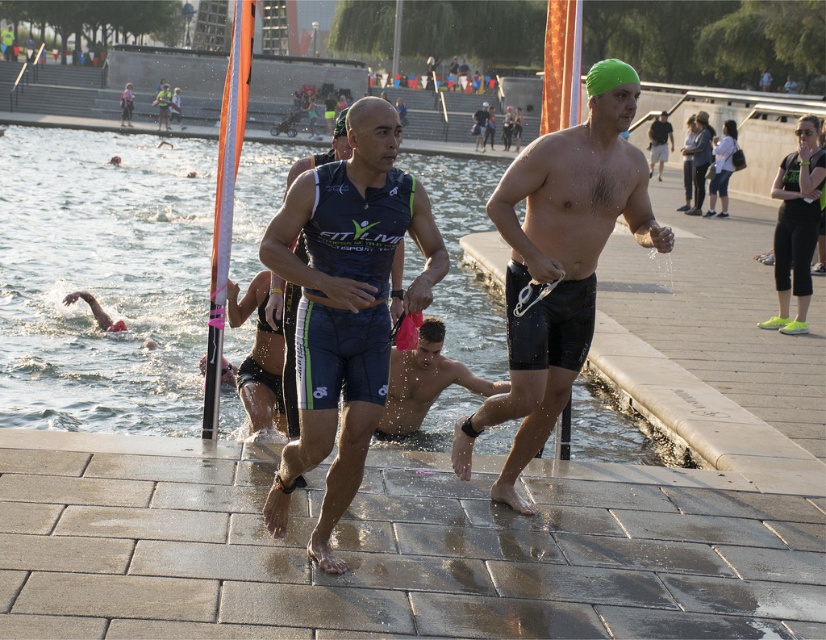
You are a photographer at the triathlon event. You want to take a photo of the green swim cap at center and the shiny wet skin at center. Which object should you focus on first if you want to capture both in one shot?

The green swim cap at center is wider than shiny wet skin at center, so you should focus on the green swim cap at center first to ensure both are in focus.

You are a photographer standing at the starting line of the triathlon. You want to capture a closeup shot of the green swim cap at center. Can you get a clear closeup without moving your position?

The green swim cap at center is 6.04 meters away from camera, so you can get a clear closeup shot without moving your position as it is within a reasonable distance for a photographer to zoom in.

You are a photographer at the triathlon event. You need to capture a closeup shot of both the green swim cap at center and the shiny wet skin at center. Which object should you zoom in on first to ensure it fills the frame properly?

The green swim cap at center is larger in size than shiny wet skin at center, so you should zoom in on the green swim cap at center first to ensure it fills the frame properly.